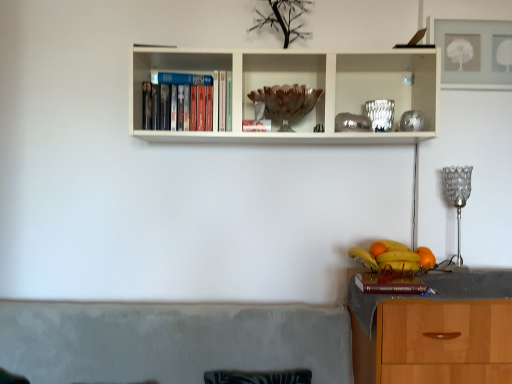
Question: Does point (394, 283) appear closer or farther from the camera than point (429, 258)?

Choices:
 (A) farther
 (B) closer

Answer: (B)

Question: In the image, is hardcover book at lower right positioned in front of or behind orange matte at right, the 1th orange from the right?

Choices:
 (A) behind
 (B) front

Answer: (B)

Question: Which of these objects is positioned farthest from the yellow matte bananas at lower right?

Choices:
 (A) hardcover book at lower right
 (B) orange matte at right, the first orange from the left
 (C) orange matte at right, the 2th orange positioned from the back
 (D) brown wooden bowl at center
 (E) silver metallic lamp at right

Answer: (D)

Question: Which object is the farthest from the hardcover book at lower right?

Choices:
 (A) orange matte at right, the 1th orange from the right
 (B) yellow matte bananas at lower right
 (C) brown wooden bowl at center
 (D) silver metallic lamp at right
 (E) clear glass vase at upper center

Answer: (C)